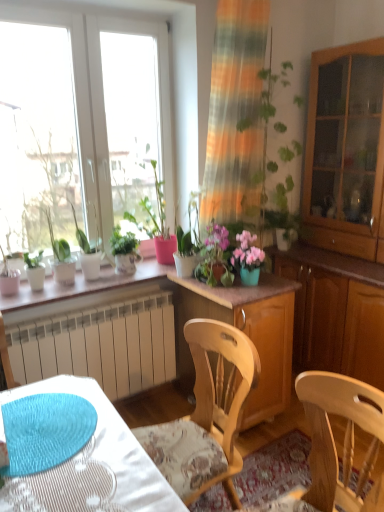
Question: From the image's perspective, relative to green matte plant at upper left, the 1th houseplant from the right, is wooden cabinet at right, which is the 1th cabinetry from top to bottom, above or below?

Choices:
 (A) above
 (B) below

Answer: (A)

Question: Considering the positions of wooden cabinet at right, the 1th cabinetry from the right, and green matte plant at upper left, the 1th houseplant from the right, in the image, is wooden cabinet at right, the 1th cabinetry from the right, taller or shorter than green matte plant at upper left, the 1th houseplant from the right,?

Choices:
 (A) short
 (B) tall

Answer: (B)

Question: Considering the real-world distances, which object is closest to the wooden cabinet at center, arranged as the second cabinetry when viewed from the top?

Choices:
 (A) pink matte flower pot at center
 (B) green matte plant at upper left, positioned as the 2th houseplant in left-to-right order
 (C) white lace tablecloth at lower left
 (D) wooden cabinet at right, the second cabinetry positioned from the left
 (E) wooden chair at center

Answer: (A)

Question: Considering the real-world distances, which object is closest to the wooden chair at center?

Choices:
 (A) green matte plant at upper left, positioned as the 2th houseplant in left-to-right order
 (B) pink matte floral arrangement at center
 (C) green matte plant at left, acting as the 1th houseplant starting from the left
 (D) pink matte flower pot at center
 (E) wooden cabinet at right

Answer: (B)